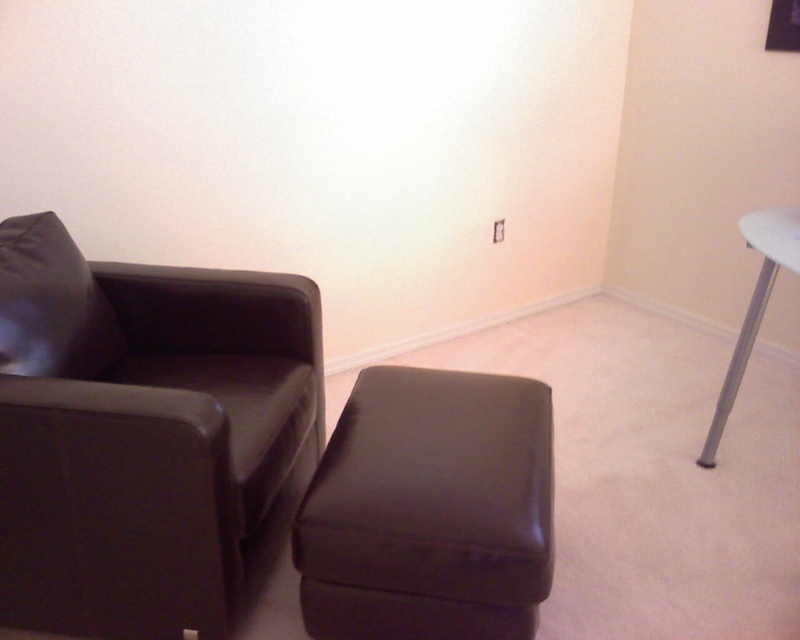
Does matte black ottoman at center appear on the right side of matte black pillow at left?

Indeed, matte black ottoman at center is positioned on the right side of matte black pillow at left.

In the scene shown: Can you confirm if matte black ottoman at center is smaller than matte black pillow at left?

No.

Between point (362, 556) and point (46, 330), which one is positioned in front?

Point (362, 556) is in front.

Where is `matte black ottoman at center`? This screenshot has height=640, width=800. matte black ottoman at center is located at coordinates (429, 509).

This screenshot has height=640, width=800. What do you see at coordinates (142, 433) in the screenshot? I see `matte brown leather swivel chair at left` at bounding box center [142, 433].

Does matte brown leather swivel chair at left appear over matte black ottoman at center?

Correct, matte brown leather swivel chair at left is located above matte black ottoman at center.

Locate an element on the screen. The height and width of the screenshot is (640, 800). matte brown leather swivel chair at left is located at coordinates (142, 433).

Between matte brown leather swivel chair at left and matte black pillow at left, which one has less height?

matte black pillow at left

Consider the image. Who is more distant from viewer, (49, 492) or (4, 253)?

Positioned behind is point (4, 253).

Where is `matte brown leather swivel chair at left`? The width and height of the screenshot is (800, 640). matte brown leather swivel chair at left is located at coordinates (142, 433).